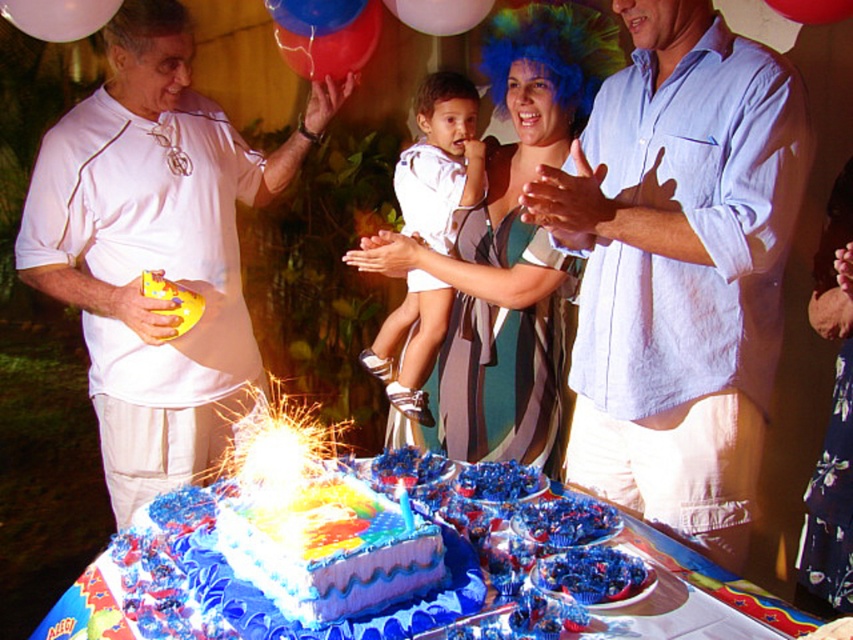
From the picture: Who is shorter, light blue linen shirt at center or white satin dress at center?

light blue linen shirt at center is shorter.

Consider the image. How much distance is there between light blue linen shirt at center and white satin dress at center?

light blue linen shirt at center and white satin dress at center are 30.70 inches apart from each other.

Who is more forward, (692, 317) or (430, 285)?

Positioned in front is point (692, 317).

You are a GUI agent. You are given a task and a screenshot of the screen. Output one action in this format:
    pyautogui.click(x=<x>, y=<y>)
    Task: Click on the light blue linen shirt at center
    This screenshot has height=640, width=853.
    Given the screenshot: What is the action you would take?
    pyautogui.click(x=679, y=268)

Does shiny blue cake at center appear on the left side of white satin dress at center?

Indeed, shiny blue cake at center is positioned on the left side of white satin dress at center.

Is point (425, 572) positioned before point (409, 280)?

Yes.

The image size is (853, 640). In order to click on shiny blue cake at center in this screenshot , I will do tap(328, 548).

Is rubberized red balloon at upper center thinner than rubber balloon at upper center?

In fact, rubberized red balloon at upper center might be wider than rubber balloon at upper center.

Who is more forward, (405,22) or (776,3)?

Positioned in front is point (776,3).

At what (x,y) coordinates should I click in order to perform the action: click on rubberized red balloon at upper center. Please return your answer as a coordinate pair (x, y). Looking at the image, I should click on (439, 13).